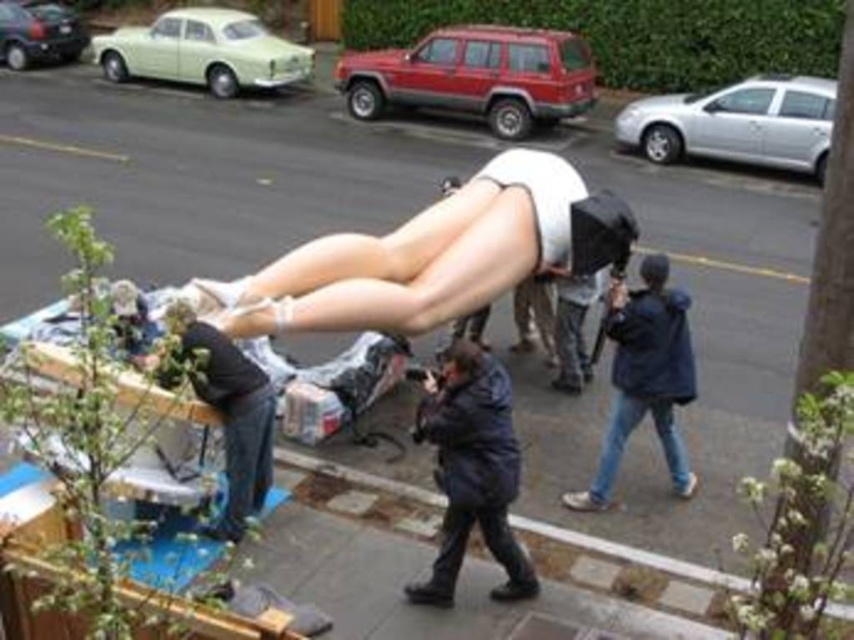
Question: Which point is farther from the camera taking this photo?

Choices:
 (A) (427, 413)
 (B) (170, 56)
 (C) (665, 337)

Answer: (B)

Question: Which object is farther from the camera taking this photo?

Choices:
 (A) dark blue puffy coat at center
 (B) red matte suv at upper center
 (C) blue denim jeans at lower right
 (D) silver metallic car at upper right

Answer: (B)

Question: Does blue denim jeans at lower right appear on the right side of light green matte car at upper left?

Choices:
 (A) no
 (B) yes

Answer: (B)

Question: Does red matte suv at upper center have a larger size compared to dark blue puffy coat at center?

Choices:
 (A) yes
 (B) no

Answer: (A)

Question: Is white matte legs at center to the left of silver metallic car at upper right from the viewer's perspective?

Choices:
 (A) no
 (B) yes

Answer: (B)

Question: Considering the real-world distances, which object is closest to the silver metallic car at upper right?

Choices:
 (A) blue denim jeans at lower right
 (B) light green matte car at upper left
 (C) dark blue puffy coat at center
 (D) white matte legs at center

Answer: (D)